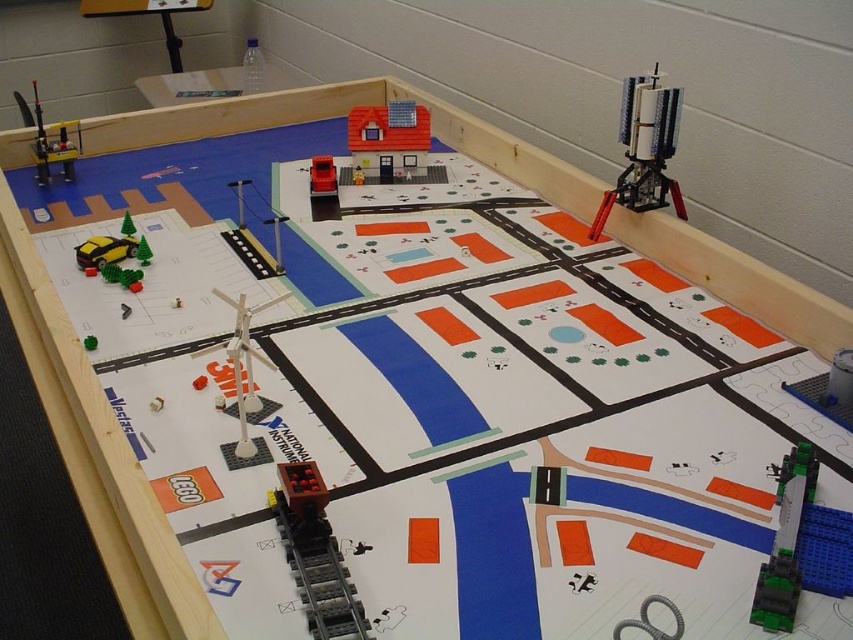
You are an observer looking at the LEGO town model on the table. You see the green plastic train at lower right and the metallic silver crane at upper left. Which object is positioned more to the right side of the table?

The green plastic train at lower right is positioned more to the right side of the table than the metallic silver crane at upper left.

You are a toy collector looking at the LEGO town model on the table. You see the green plastic train at lower right and the brick red car at center. Which toy is positioned closer to the edge of the table?

The green plastic train at lower right is closer to the viewer than the brick red car at center, so it is positioned closer to the edge of the table.